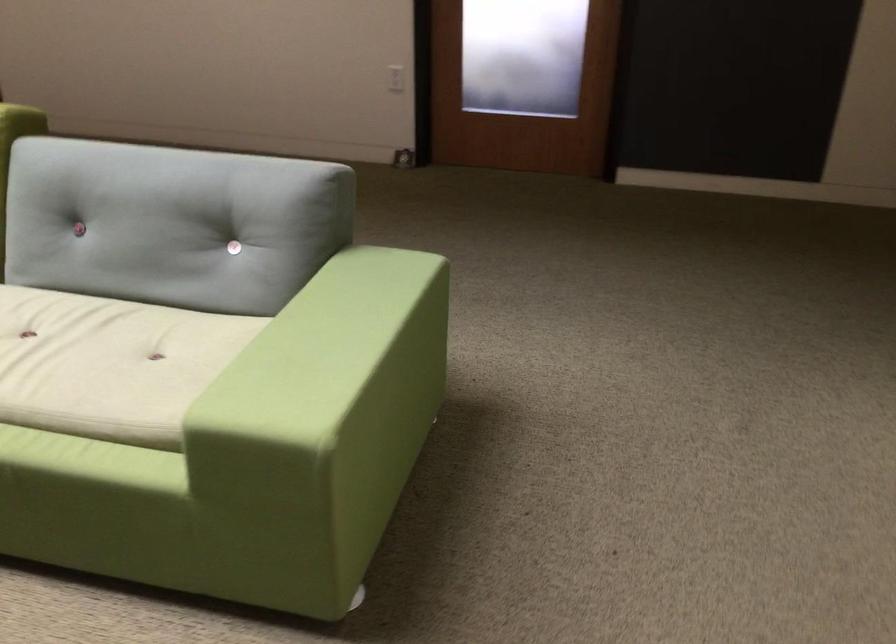
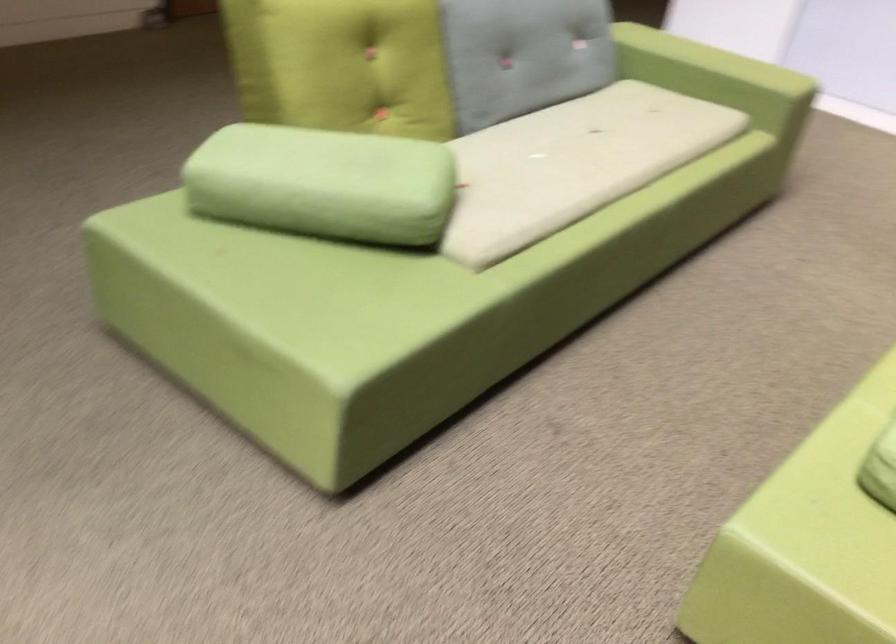
Where in the second image is the point corresponding to point (220, 361) from the first image?

(717, 77)